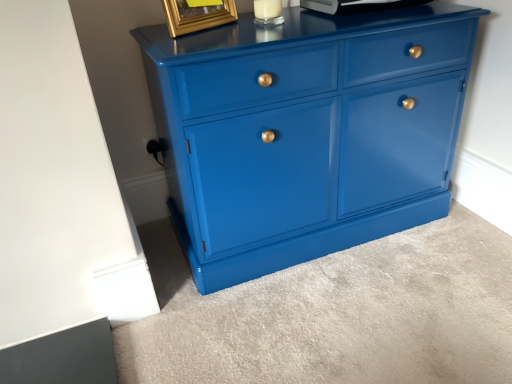
Question: From a real-world perspective, is metallic silver appliance at upper center under glossy blue cabinet at center?

Choices:
 (A) no
 (B) yes

Answer: (A)

Question: Is metallic silver appliance at upper center at the left side of glossy blue cabinet at center?

Choices:
 (A) no
 (B) yes

Answer: (A)

Question: Does metallic silver appliance at upper center have a greater width compared to glossy blue cabinet at center?

Choices:
 (A) no
 (B) yes

Answer: (A)

Question: From a real-world perspective, is metallic silver appliance at upper center over glossy blue cabinet at center?

Choices:
 (A) no
 (B) yes

Answer: (B)

Question: Does metallic silver appliance at upper center have a smaller size compared to glossy blue cabinet at center?

Choices:
 (A) yes
 (B) no

Answer: (A)

Question: Is metallic silver appliance at upper center oriented away from glossy blue cabinet at center?

Choices:
 (A) yes
 (B) no

Answer: (B)

Question: Considering the relative sizes of glossy blue cabinet at center and metallic silver appliance at upper center in the image provided, is glossy blue cabinet at center thinner than metallic silver appliance at upper center?

Choices:
 (A) yes
 (B) no

Answer: (B)

Question: Does glossy blue cabinet at center lie behind metallic silver appliance at upper center?

Choices:
 (A) yes
 (B) no

Answer: (B)

Question: From the image's perspective, is glossy blue cabinet at center under metallic silver appliance at upper center?

Choices:
 (A) yes
 (B) no

Answer: (A)

Question: Considering the relative sizes of glossy blue cabinet at center and metallic silver appliance at upper center in the image provided, is glossy blue cabinet at center taller than metallic silver appliance at upper center?

Choices:
 (A) no
 (B) yes

Answer: (B)

Question: From the image's perspective, would you say glossy blue cabinet at center is positioned over metallic silver appliance at upper center?

Choices:
 (A) no
 (B) yes

Answer: (A)

Question: Does glossy blue cabinet at center appear on the left side of metallic silver appliance at upper center?

Choices:
 (A) no
 (B) yes

Answer: (B)

Question: Considering the relative sizes of glossy blue cabinet at center and gold metallic picture frame at upper center in the image provided, is glossy blue cabinet at center taller than gold metallic picture frame at upper center?

Choices:
 (A) yes
 (B) no

Answer: (A)